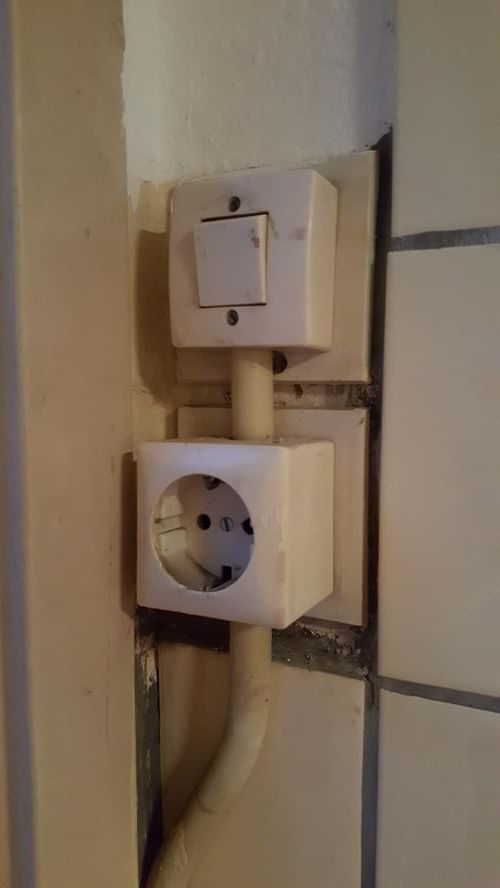
Where is `switch`? The image size is (500, 888). switch is located at coordinates tap(217, 270).